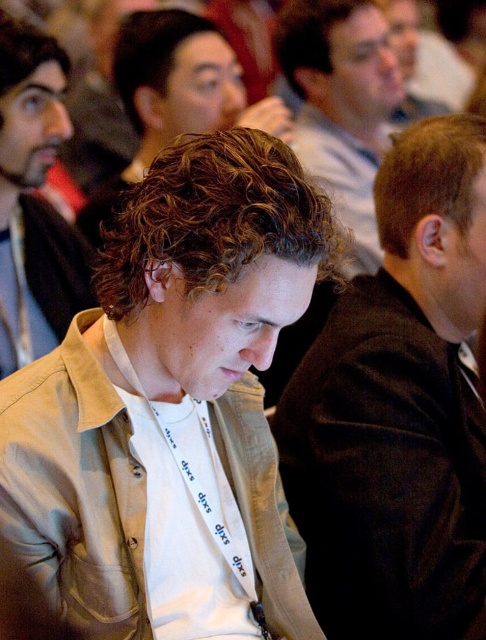
You are an event organizer who needs to adjust seating arrangements. You see the beige fabric shirt at center and the light brown jacket at center. Which one is more to the right?

The beige fabric shirt at center is more to the right than the light brown jacket at center.

Based on the photo, you are a photographer trying to capture a candid shot of the beige fabric shirt at center. The camera is set to focus on the point at coordinates (172, 406). Will the beige fabric shirt at center be in focus?

The point at coordinates (172, 406) indicates the beige fabric shirt at center, so yes, the beige fabric shirt at center will be in focus.

You are a photographer at the event and need to capture a clear shot of the beige fabric shirt at center and the light brown curly hair at center. Based on their positions, which object should be placed to the left in your photo?

The light brown curly hair at center should be placed to the left in the photo since the beige fabric shirt at center is positioned on the right side of light brown curly hair at center.